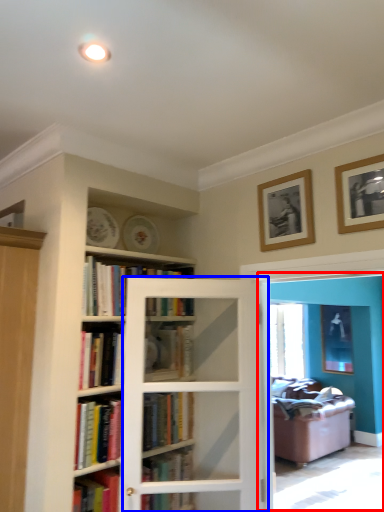
Question: Among these objects, which one is nearest to the camera, screen door (highlighted by a red box) or screen door (highlighted by a blue box)?

Choices:
 (A) screen door
 (B) screen door

Answer: (A)